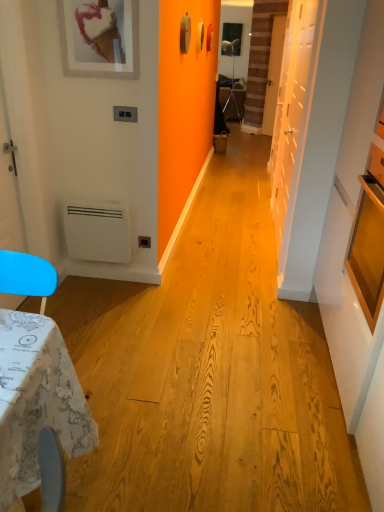
This screenshot has width=384, height=512. I want to click on free spot below white matte heater at lower left (from a real-world perspective), so click(x=95, y=276).